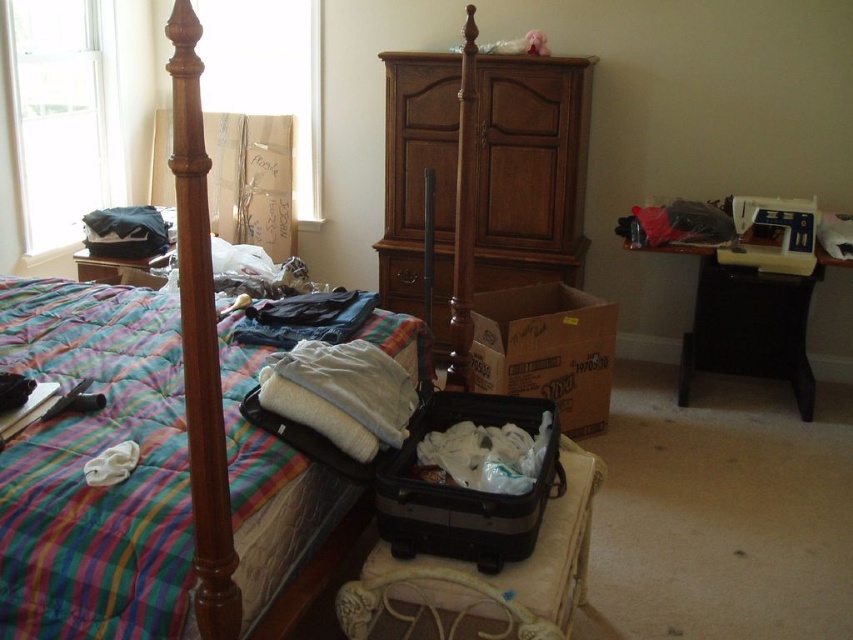
You are trying to place the white soft blanket at center onto the wooden cabinet at center. Can you fit it on top without folding?

The wooden cabinet at center might be wider than white soft blanket at center, so there is a possibility that the blanket can be placed without folding, but it depends on the exact dimensions. However, since the description only mentions the cabinet might be wider, we cannot be certain. Please check the actual size before placing.

You are trying to reach the dark blue fabric at center to fold it away. However, there is a black hardshell suitcase at center in the way. Based on the scene description, can you determine if the suitcase is blocking your path to the dark blue fabric?

The black hardshell suitcase at center is located below the dark blue fabric at center, so the suitcase is not blocking your path to the dark blue fabric.